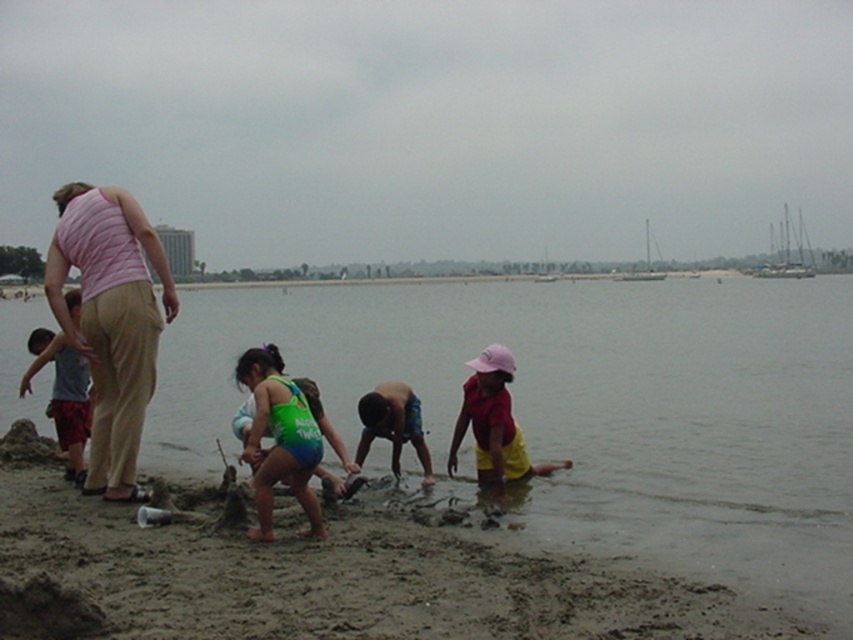
You are a photographer trying to capture a shot of the clear water at lower left and the matte gray shirt at left. Based on the scene, which object is positioned to the right of the other?

The clear water at lower left is positioned to the right of the matte gray shirt at left.